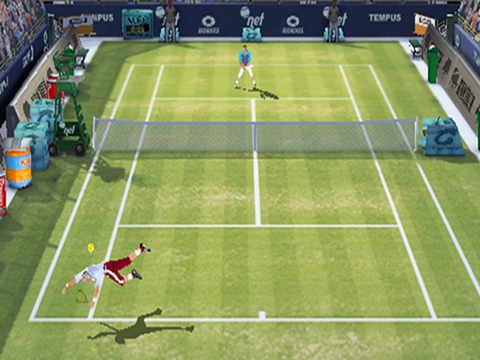
This screenshot has height=360, width=480. Identify the location of green chair. (68, 70).